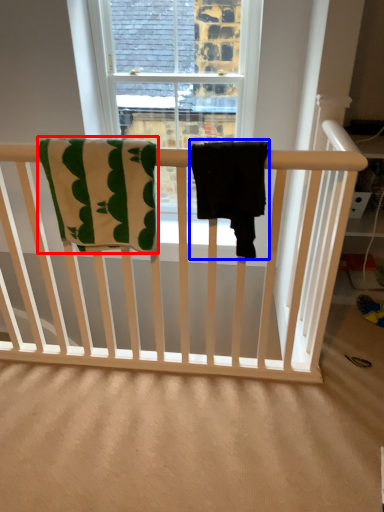
Question: Which object is further to the camera taking this photo, beach towel (highlighted by a red box) or beach towel (highlighted by a blue box)?

Choices:
 (A) beach towel
 (B) beach towel

Answer: (A)